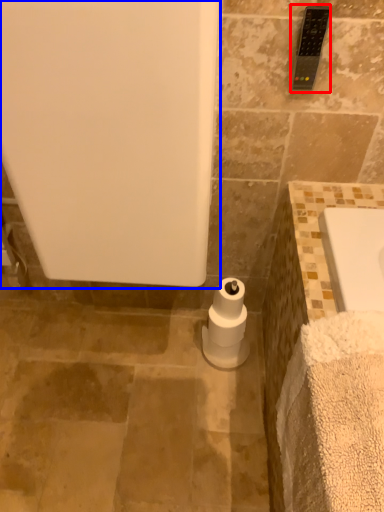
Question: Which of the following is the farthest to the observer, towel bar (highlighted by a red box) or bath (highlighted by a blue box)?

Choices:
 (A) towel bar
 (B) bath

Answer: (A)